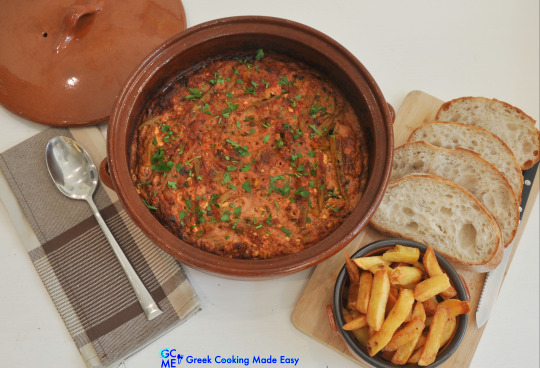
This screenshot has height=368, width=540. Find the location of `utensil`. utensil is located at coordinates (68, 173), (488, 295).